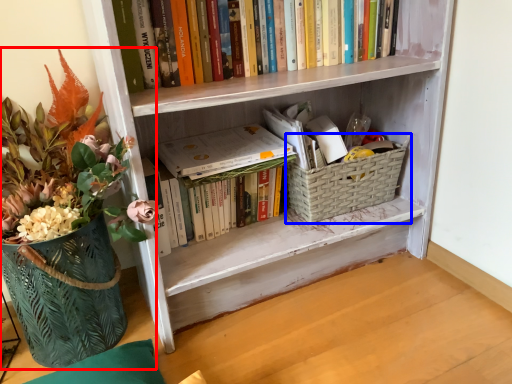
Question: Which point is further to the camera, houseplant (highlighted by a red box) or basket container (highlighted by a blue box)?

Choices:
 (A) houseplant
 (B) basket container

Answer: (B)